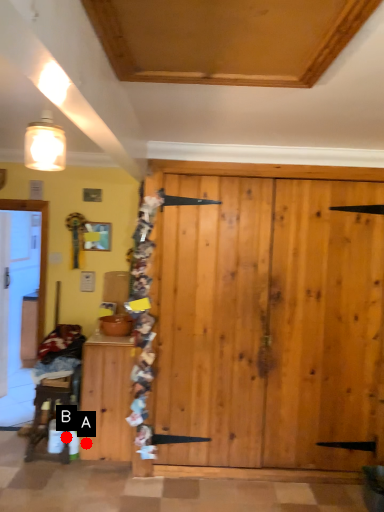
Question: Two points are circled on the image, labeled by A and B beside each circle. Which of the following is the farthest from the observer?

Choices:
 (A) A is further
 (B) B is further

Answer: (B)